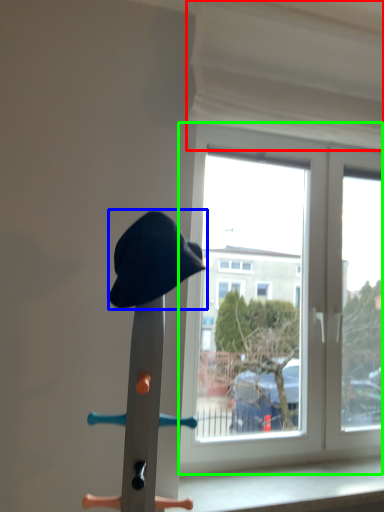
Question: Estimate the real-world distances between objects in this image. Which object is closer to curtain (highlighted by a red box), hat (highlighted by a blue box) or window (highlighted by a green box)?

Choices:
 (A) hat
 (B) window

Answer: (B)